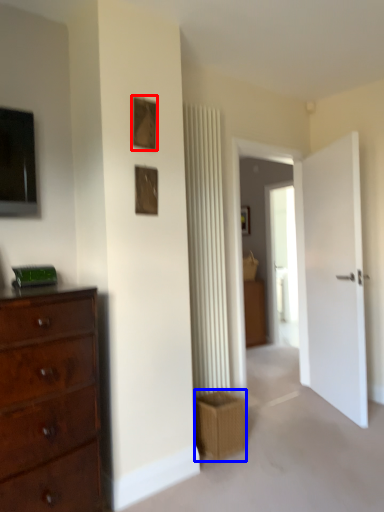
Question: Which of the following is the closest to the observer, picture frame (highlighted by a red box) or crate (highlighted by a blue box)?

Choices:
 (A) picture frame
 (B) crate

Answer: (A)